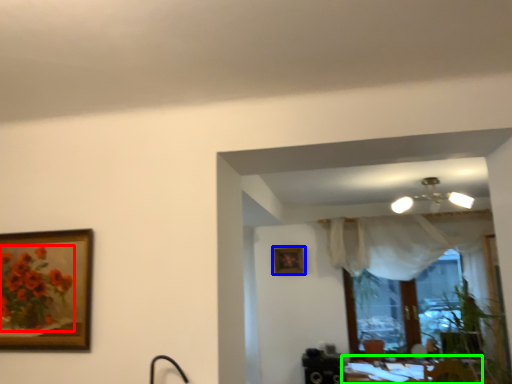
Question: Which object is the farthest from flower (highlighted by a red box)? Choose among these: picture frame (highlighted by a blue box) or table (highlighted by a green box).

Choices:
 (A) picture frame
 (B) table

Answer: (B)